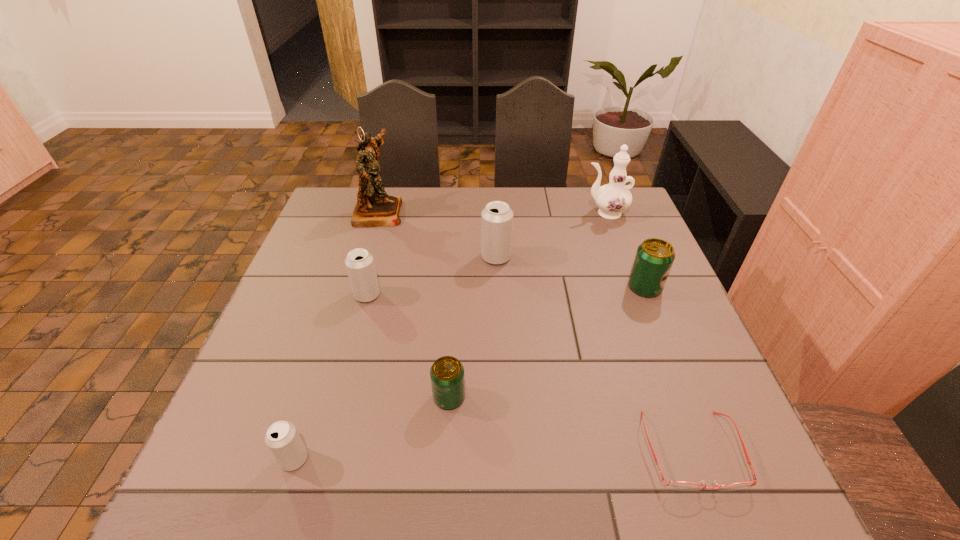
At what (x,y) coordinates should I click in order to perform the action: click on vacant position located 0.330m on the left of the farther green beer can. Please return your answer as a coordinate pair (x, y). Looking at the image, I should click on (501, 288).

At what (x,y) coordinates should I click in order to perform the action: click on free location located on the back of the third beer can from right to left. Please return your answer as a coordinate pair (x, y). This screenshot has width=960, height=540. Looking at the image, I should click on (457, 274).

The width and height of the screenshot is (960, 540). Find the location of `vacant space located 0.090m on the left of the nearest beer can`. vacant space located 0.090m on the left of the nearest beer can is located at coordinates click(231, 459).

At what (x,y) coordinates should I click in order to perform the action: click on figurine that is at the far edge. Please return your answer as a coordinate pair (x, y). The image size is (960, 540). Looking at the image, I should click on (374, 208).

You are a GUI agent. You are given a task and a screenshot of the screen. Output one action in this format:
    pyautogui.click(x=<x>, y=<y>)
    Task: Click on the chinaware that is positioned at the far edge
    Image resolution: width=960 pixels, height=540 pixels.
    Given the screenshot: What is the action you would take?
    pyautogui.click(x=613, y=198)

At what (x,y) coordinates should I click in order to perform the action: click on beer can present at the near edge. Please return your answer as a coordinate pair (x, y). The height and width of the screenshot is (540, 960). Looking at the image, I should click on pos(282,438).

Locate an element on the screen. This screenshot has height=540, width=960. spectacles located at the near edge is located at coordinates (676, 485).

Where is `figurine located at the left edge`? This screenshot has width=960, height=540. figurine located at the left edge is located at coordinates (374, 208).

In order to click on beer can situated at the left edge in this screenshot , I will do `click(282, 438)`.

In order to click on chinaware present at the right edge in this screenshot , I will do `click(613, 198)`.